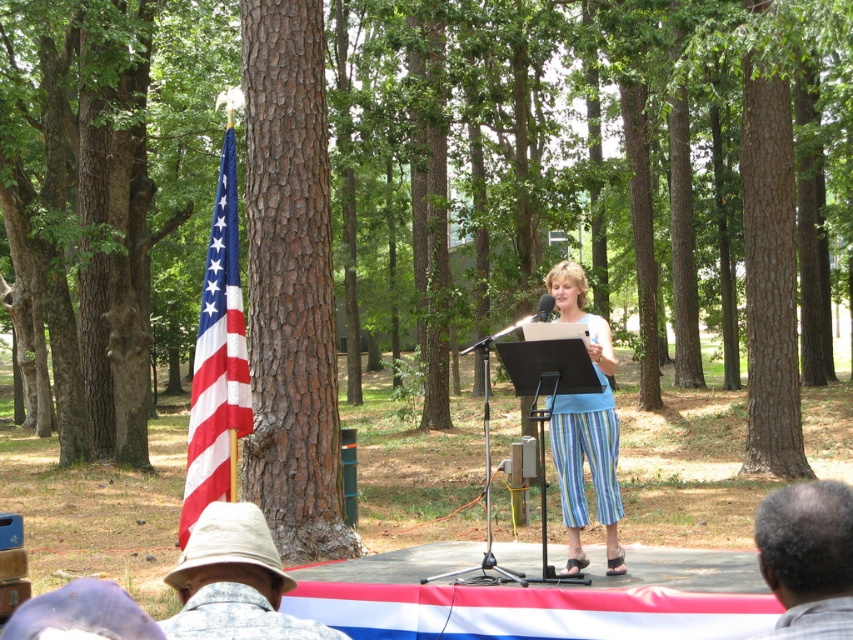
You are a photographer setting up for an event. You need to decide which object, the brown rough bark tree at left or the black plastic microphone at center, will block more of your camera view if placed in front of it. Based on their sizes, which one would block more of the view?

The brown rough bark tree at left is bigger than the black plastic microphone at center, so it would block more of the camera view.

You are an event planner setting up for a speech in the woods. You see a brown rough bark tree at left and a black plastic microphone at center. Which object is positioned to the left of the other?

The brown rough bark tree at left is to the left of black plastic microphone at center.

You are attending an outdoor event in a wooded area and see a brown rough bark tree at left and a blue striped pants at center. Which object is located to the left of the other?

The brown rough bark tree at left is positioned on the left side of blue striped pants at center.